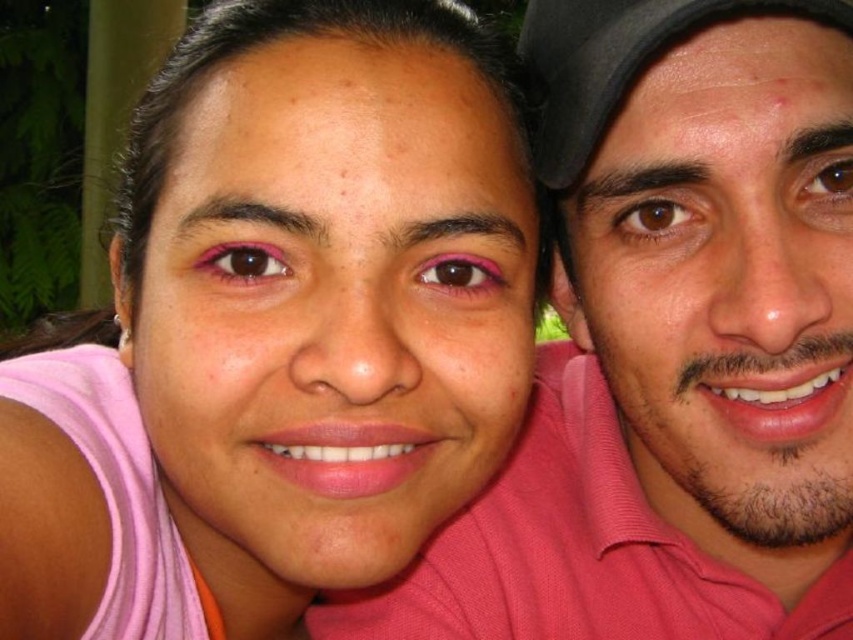
Is point (555, 150) closer to viewer compared to point (624, 49)?

No, (555, 150) is further to viewer.

Is pink matte shirt at right smaller than black fabric baseball cap at upper right?

No, pink matte shirt at right is not smaller than black fabric baseball cap at upper right.

Locate an element on the screen. Image resolution: width=853 pixels, height=640 pixels. pink matte shirt at right is located at coordinates (672, 344).

Which is more to the right, pink matte skin at center or black fabric baseball cap at upper right?

black fabric baseball cap at upper right is more to the right.

Identify the location of pink matte skin at center. The image size is (853, 640). (279, 330).

The width and height of the screenshot is (853, 640). Find the location of `pink matte skin at center`. pink matte skin at center is located at coordinates (279, 330).

Which is more to the left, pink matte shirt at right or pink cotton polo shirt at center?

pink cotton polo shirt at center

Does pink matte shirt at right have a lesser width compared to pink cotton polo shirt at center?

Correct, pink matte shirt at right's width is less than pink cotton polo shirt at center's.

At what (x,y) coordinates should I click in order to perform the action: click on pink matte shirt at right. Please return your answer as a coordinate pair (x, y). The image size is (853, 640). Looking at the image, I should click on (672, 344).